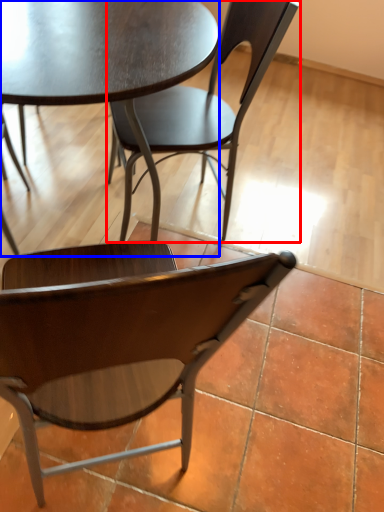
Question: Which object is further to the camera taking this photo, chair (highlighted by a red box) or coffee table (highlighted by a blue box)?

Choices:
 (A) chair
 (B) coffee table

Answer: (A)